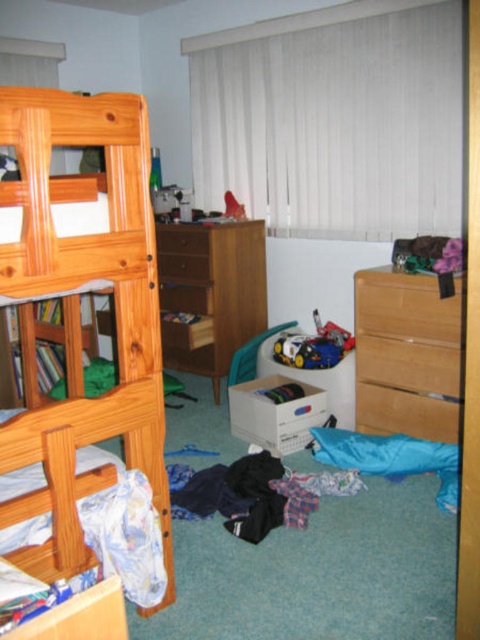
Is natural wood bunk bed at left below light brown wooden dresser at right?

Correct, natural wood bunk bed at left is located below light brown wooden dresser at right.

Describe the element at coordinates (76, 298) in the screenshot. This screenshot has height=640, width=480. I see `natural wood bunk bed at left` at that location.

Which is behind, point (96, 426) or point (399, 369)?

The point (399, 369) is more distant.

Where is `natural wood bunk bed at left`? natural wood bunk bed at left is located at coordinates (76, 298).

Does point (388, 276) come closer to viewer compared to point (196, 324)?

Yes, it is in front of point (196, 324).

Identify the location of light brown wooden dresser at right. This screenshot has height=640, width=480. (407, 355).

Who is positioned more to the left, natural wood bunk bed at left or wooden dresser at center?

From the viewer's perspective, natural wood bunk bed at left appears more on the left side.

Can you confirm if natural wood bunk bed at left is shorter than wooden dresser at center?

No, natural wood bunk bed at left is not shorter than wooden dresser at center.

Who is more forward, (26, 461) or (255, 256)?

Point (26, 461) is more forward.

Locate an element on the screen. This screenshot has height=640, width=480. natural wood bunk bed at left is located at coordinates click(76, 298).